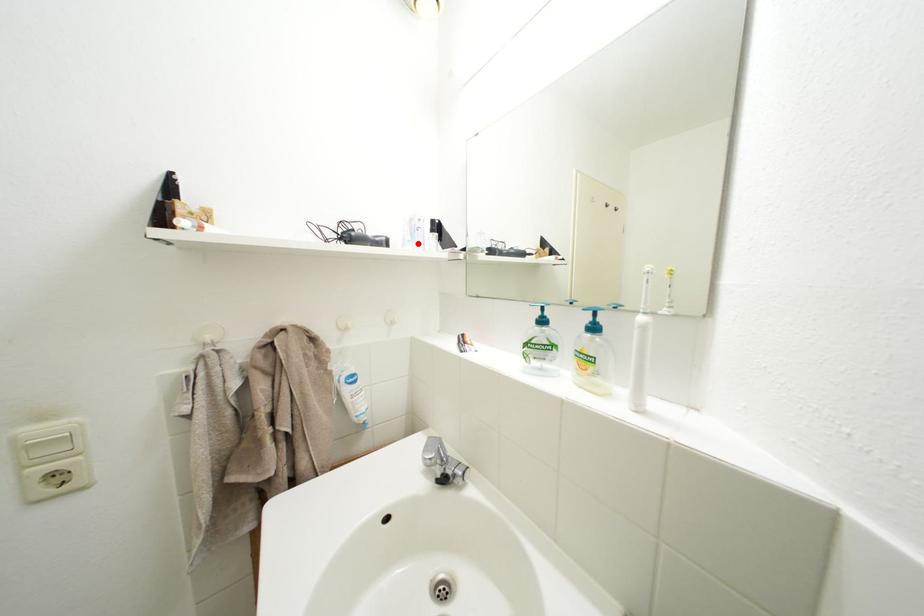
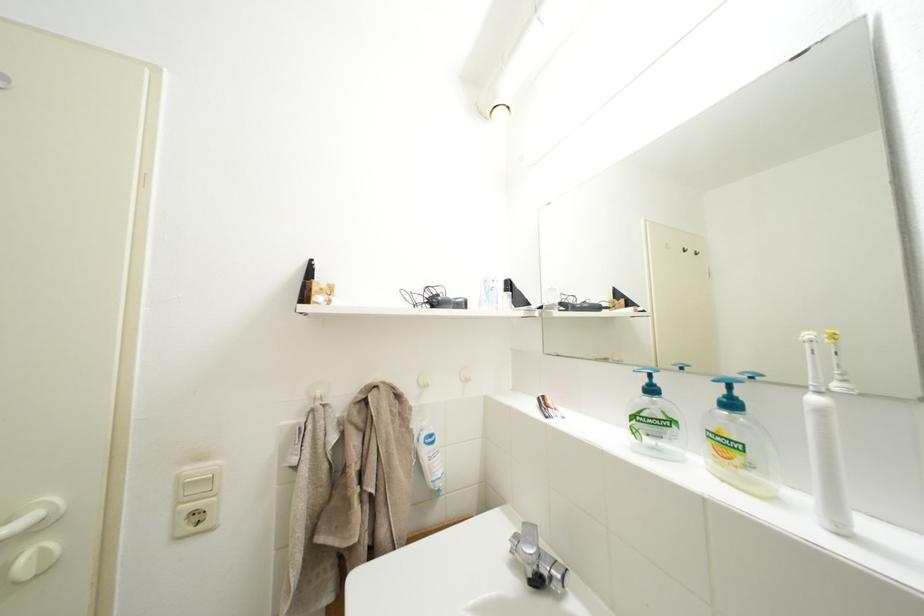
The point at the highlighted location is marked in the first image. Where is the corresponding point in the second image?

(493, 302)